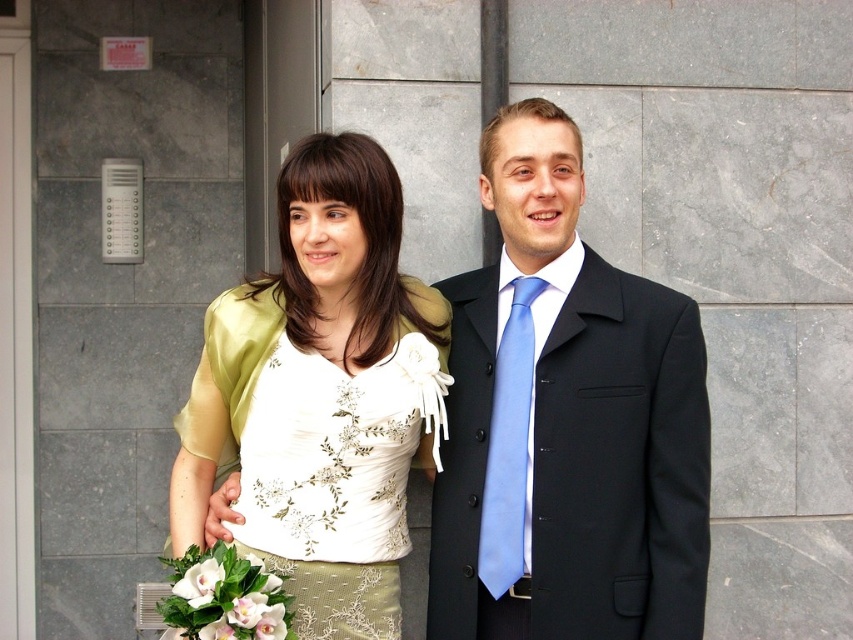
Which is in front, point (554, 522) or point (444, 321)?

Point (554, 522) is more forward.

What do you see at coordinates (566, 422) in the screenshot?
I see `matte black suit at center` at bounding box center [566, 422].

Is point (654, 346) farther from viewer compared to point (190, 492)?

No, it is in front of (190, 492).

This screenshot has width=853, height=640. I want to click on matte black suit at center, so click(x=566, y=422).

This screenshot has width=853, height=640. Describe the element at coordinates (316, 397) in the screenshot. I see `matte gold blouse at center` at that location.

Between matte gold blouse at center and light blue satin tie at center, which one appears on the left side from the viewer's perspective?

From the viewer's perspective, matte gold blouse at center appears more on the left side.

The width and height of the screenshot is (853, 640). I want to click on matte gold blouse at center, so click(x=316, y=397).

Who is positioned more to the left, black woolen suit at center or white satin dress at center?

white satin dress at center is more to the left.

Is black woolen suit at center taller than white satin dress at center?

Indeed, black woolen suit at center has a greater height compared to white satin dress at center.

Find the location of `black woolen suit at center`. black woolen suit at center is located at coordinates (619, 464).